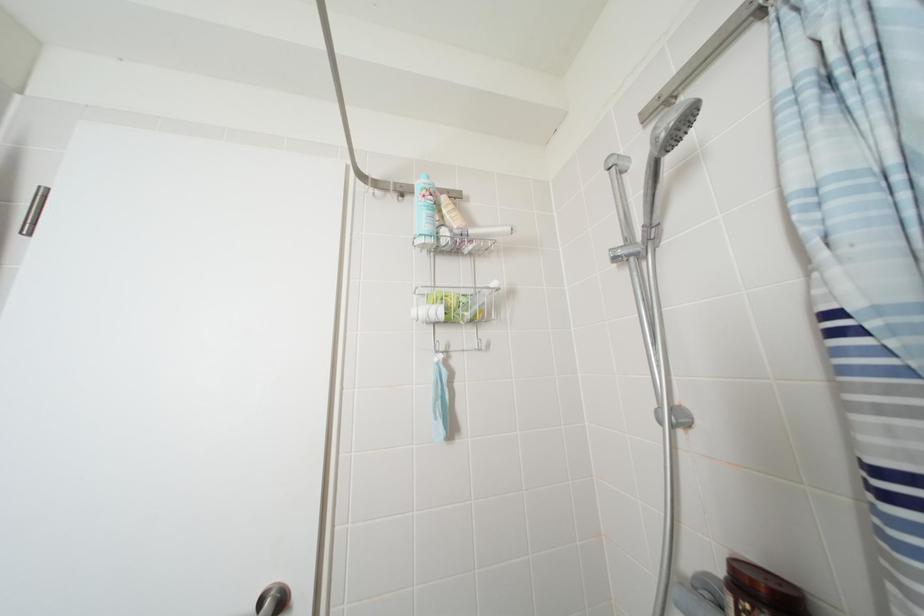
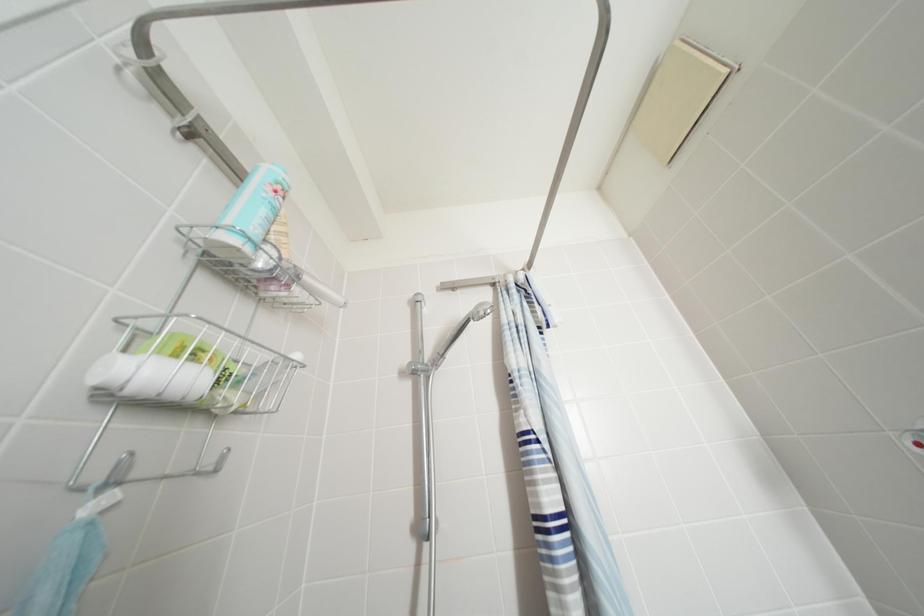
Based on the continuous images, in which direction is the camera rotating?

The camera's rotation is toward right-up.